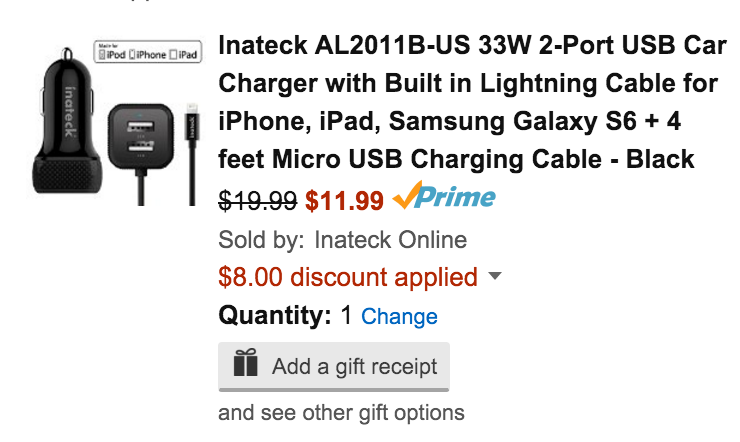
Locate an element on the screen. This screenshot has width=740, height=442. usb port is located at coordinates (144, 145).